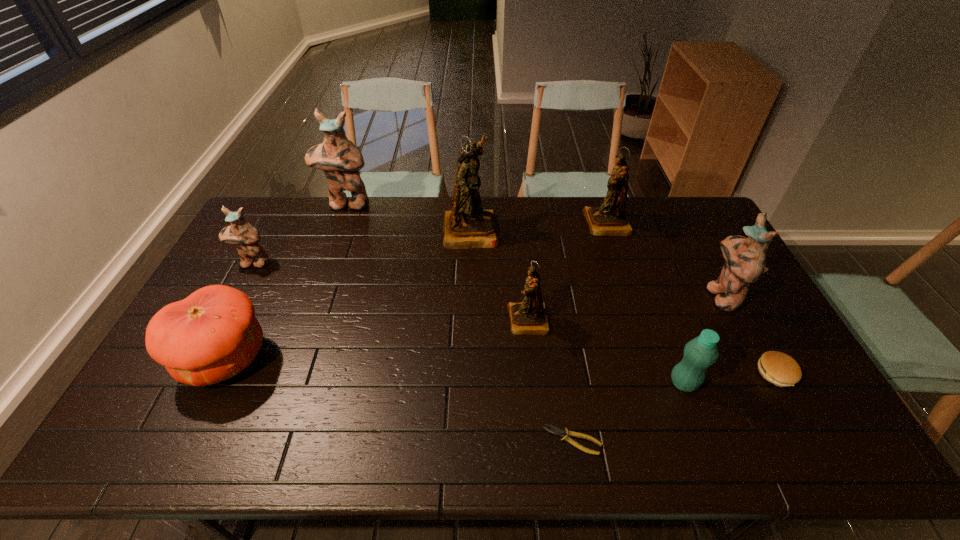
The image size is (960, 540). Find the location of `the farthest pink figurine`. the farthest pink figurine is located at coordinates (341, 161).

What are the coordinates of `the second pink figurine from left to right` in the screenshot? It's located at (341, 161).

Where is `the leftmost gold figurine`? the leftmost gold figurine is located at coordinates click(x=466, y=226).

This screenshot has height=540, width=960. I want to click on the biggest gold figurine, so click(x=466, y=226).

Where is `the rightmost gold figurine`? This screenshot has height=540, width=960. the rightmost gold figurine is located at coordinates (609, 219).

Where is `the second biggest gold figurine`? Image resolution: width=960 pixels, height=540 pixels. the second biggest gold figurine is located at coordinates (609, 219).

At what (x,y) coordinates should I click in order to perform the action: click on the nearest pink figurine. Please return your answer as a coordinate pair (x, y). Looking at the image, I should click on (745, 258).

The width and height of the screenshot is (960, 540). I want to click on the rightmost figurine, so click(x=745, y=258).

Identify the location of the seventh nearest object. This screenshot has height=540, width=960. (245, 237).

Identify the location of the smallest pink figurine. The width and height of the screenshot is (960, 540). (245, 237).